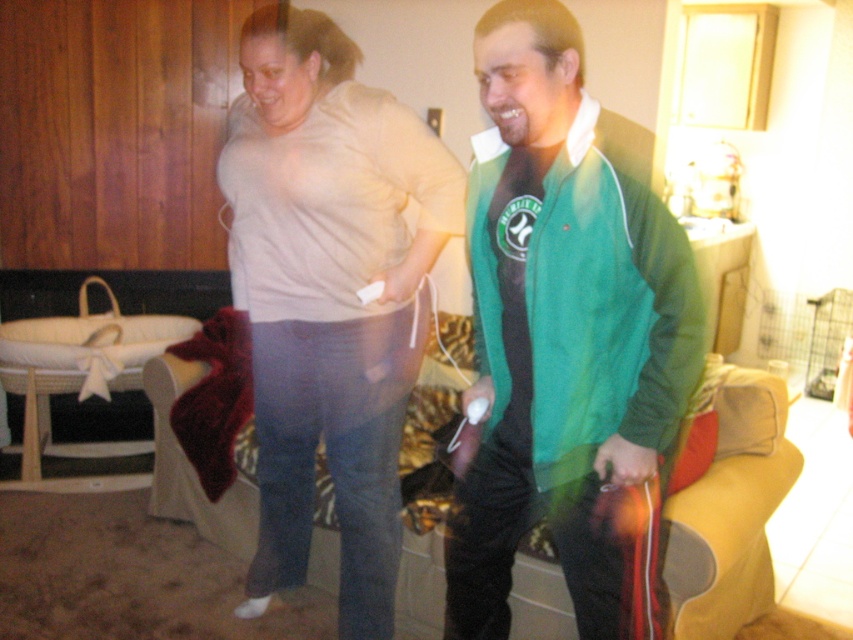
Can you confirm if green fleece jacket at center is positioned above matte beige shirt at center?

No, green fleece jacket at center is not above matte beige shirt at center.

Does green fleece jacket at center appear on the left side of matte beige shirt at center?

Incorrect, green fleece jacket at center is not on the left side of matte beige shirt at center.

Find the location of a particular element. The image size is (853, 640). green fleece jacket at center is located at coordinates (561, 321).

Identify the location of green fleece jacket at center. This screenshot has width=853, height=640. (561, 321).